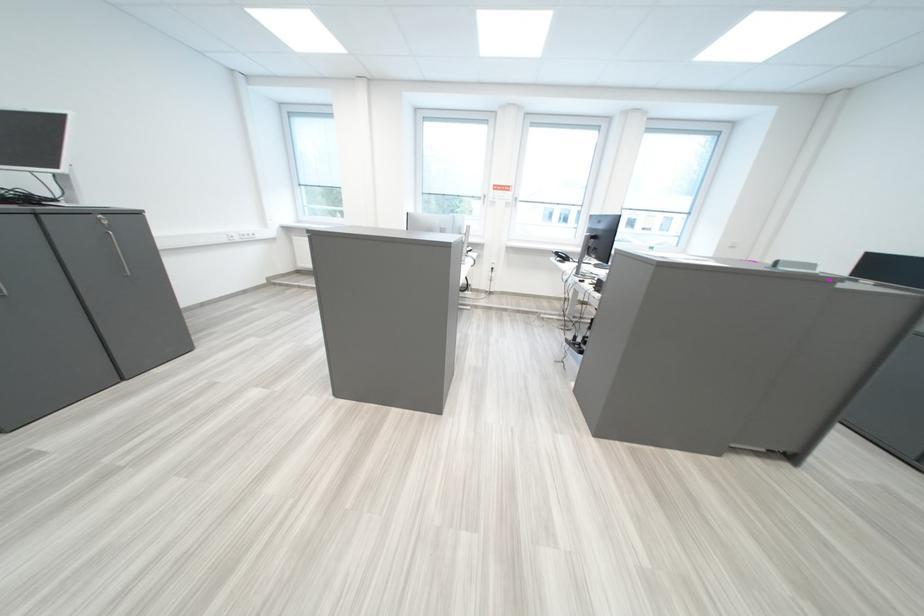
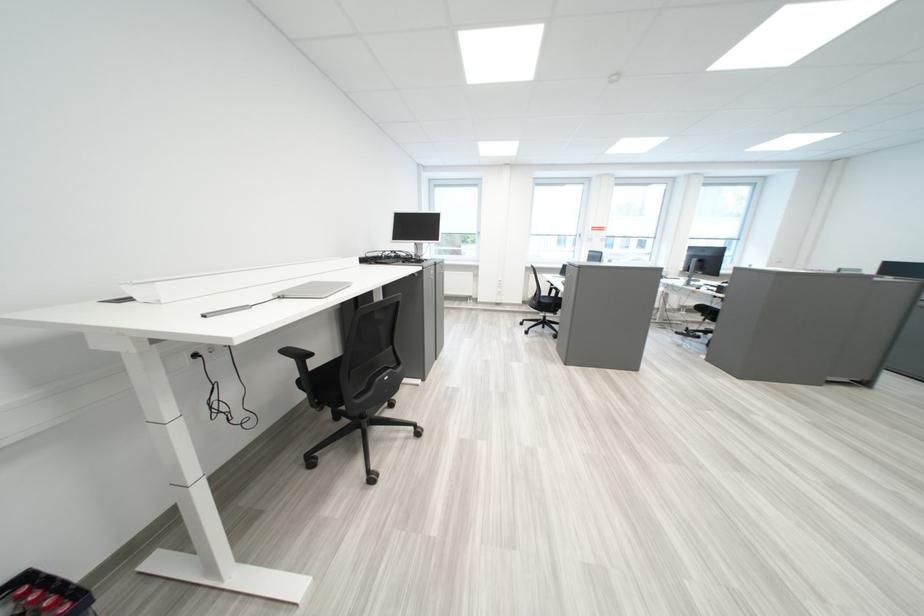
What movement of the cameraman would produce the second image?

The cameraman walked toward left, backward.